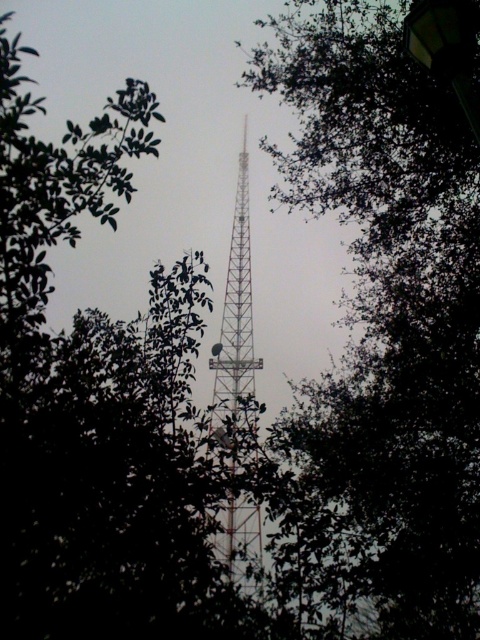
The width and height of the screenshot is (480, 640). I want to click on green leafy tree at center, so click(389, 301).

Is green leafy tree at center further to the viewer compared to metallic lattice tower at center?

No, green leafy tree at center is closer to the viewer.

Where is `green leafy tree at center`? green leafy tree at center is located at coordinates (389, 301).